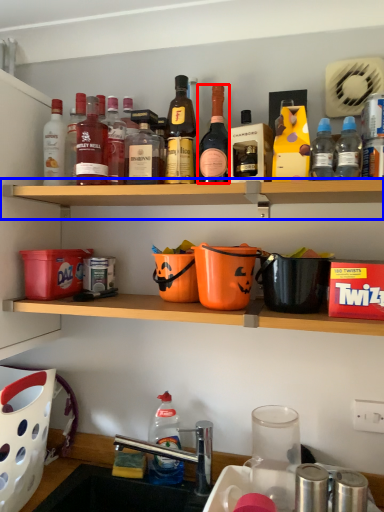
Question: Which point is further to the camera, bottle (highlighted by a red box) or shelf (highlighted by a blue box)?

Choices:
 (A) bottle
 (B) shelf

Answer: (A)